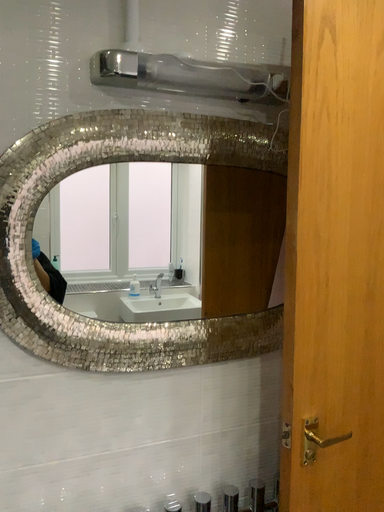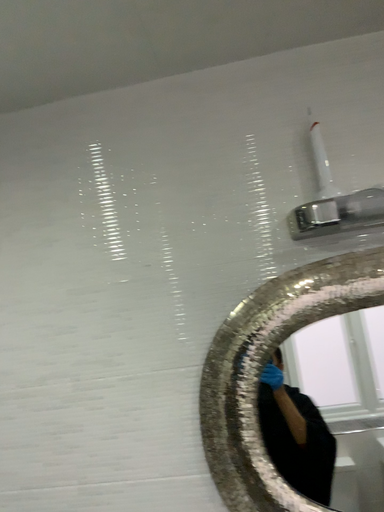
Question: Which way did the camera rotate in the video?

Choices:
 (A) rotated upward
 (B) rotated downward

Answer: (A)